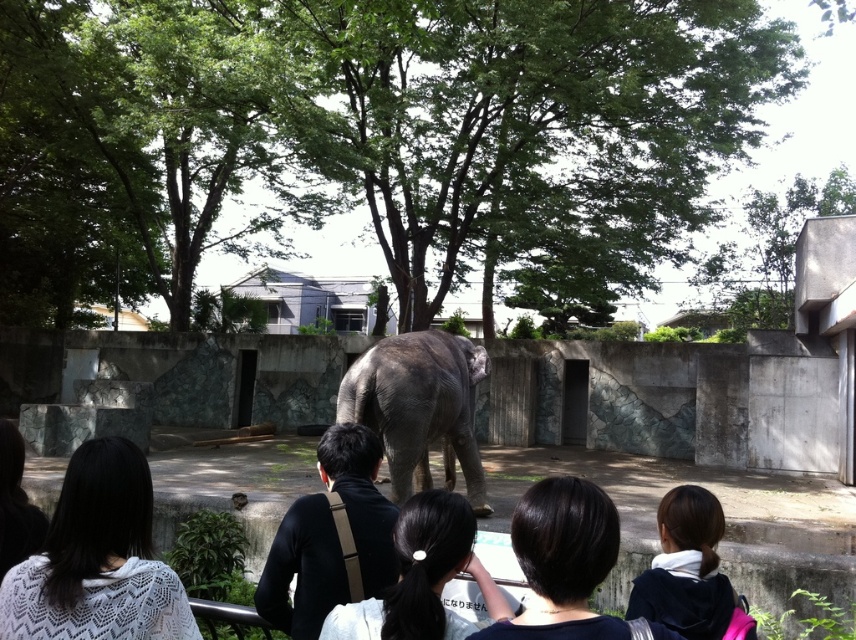
Does gray matte elephant at center lie behind dark brown hair at center?

Yes, it is behind dark brown hair at center.

Which is in front, point (387, 348) or point (675, 636)?

Point (675, 636)

Describe the element at coordinates (419, 406) in the screenshot. I see `gray matte elephant at center` at that location.

At what (x,y) coordinates should I click in order to perform the action: click on gray matte elephant at center. Please return your answer as a coordinate pair (x, y). This screenshot has width=856, height=640. Looking at the image, I should click on (419, 406).

Does white knitted sweater at lower left appear on the right side of gray matte elephant at center?

No, white knitted sweater at lower left is not to the right of gray matte elephant at center.

Between white knitted sweater at lower left and gray matte elephant at center, which one has more height?

gray matte elephant at center

Who is more distant from viewer, (x=91, y=445) or (x=391, y=412)?

The point (x=391, y=412) is more distant.

At what (x,y) coordinates should I click in order to perform the action: click on white knitted sweater at lower left. Please return your answer as a coordinate pair (x, y). The height and width of the screenshot is (640, 856). Looking at the image, I should click on (97, 560).

Who is taller, black hair at center or dark brown hair at lower right?

Standing taller between the two is dark brown hair at lower right.

Image resolution: width=856 pixels, height=640 pixels. Describe the element at coordinates (421, 577) in the screenshot. I see `black hair at center` at that location.

Identify the location of black hair at center. The height and width of the screenshot is (640, 856). (421, 577).